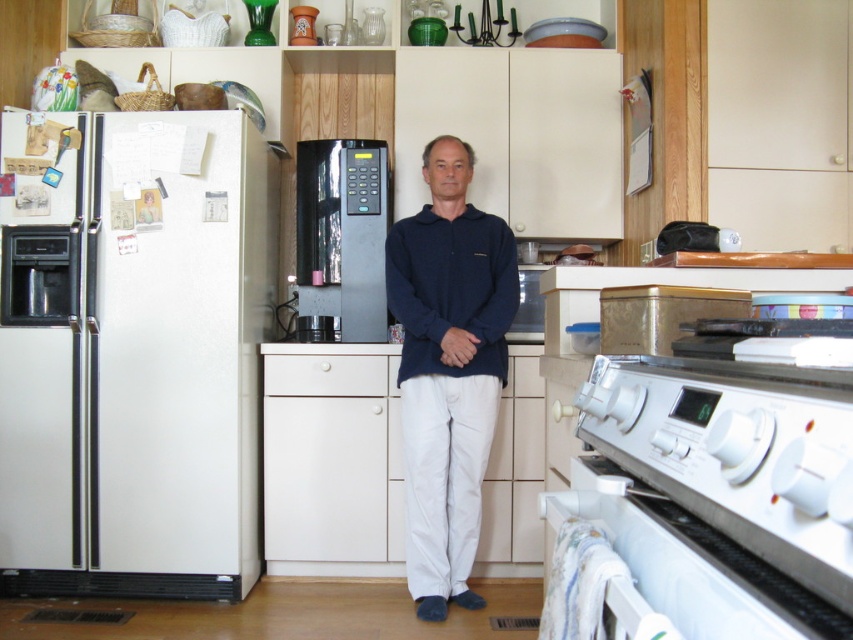
Question: Which of the following is the farthest from the observer?

Choices:
 (A) (374, 177)
 (B) (25, 237)

Answer: (A)

Question: Is white matte refrigerator at left in front of white glossy oven at lower right?

Choices:
 (A) no
 (B) yes

Answer: (A)

Question: Is white glossy oven at lower right to the left of black plastic microwave at center from the viewer's perspective?

Choices:
 (A) no
 (B) yes

Answer: (A)

Question: Among these points, which one is farthest from the camera?

Choices:
 (A) (351, 144)
 (B) (811, 388)
 (C) (453, 209)
 (D) (199, 339)

Answer: (A)

Question: Which object is positioned farthest from the white matte refrigerator at left?

Choices:
 (A) navy blue sweater at center
 (B) white glossy oven at lower right

Answer: (B)

Question: Does white glossy oven at lower right appear over navy blue sweater at center?

Choices:
 (A) no
 (B) yes

Answer: (A)